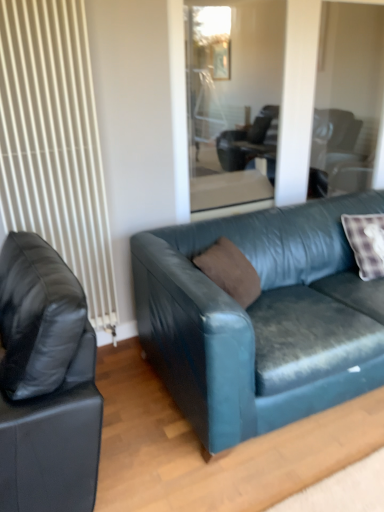
Question: Is brown suede pillow at center taller or shorter than transparent glass door at center?

Choices:
 (A) short
 (B) tall

Answer: (A)

Question: Is point (240, 287) positioned closer to the camera than point (206, 14)?

Choices:
 (A) closer
 (B) farther

Answer: (A)

Question: Based on their relative distances, which object is nearer to the white ribbed radiator at left?

Choices:
 (A) brown suede pillow at center
 (B) teal leather couch at center, which ranks as the second studio couch in left-to-right order
 (C) matte black leather couch at left, which ranks as the first studio couch in left-to-right order
 (D) transparent glass door at center

Answer: (C)

Question: Which object is positioned farthest from the white ribbed radiator at left?

Choices:
 (A) teal leather couch at center, the 1th studio couch positioned from the right
 (B) transparent glass door at center
 (C) brown suede pillow at center
 (D) matte black leather couch at left, which appears as the second studio couch when viewed from the right

Answer: (B)